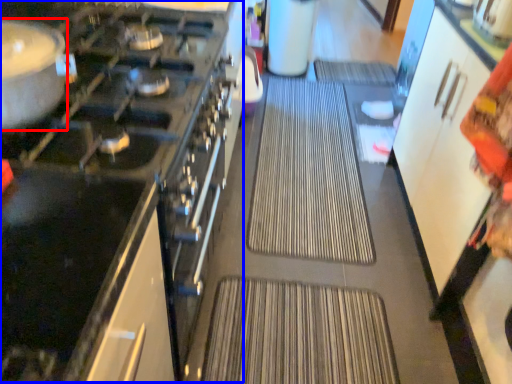
Question: Which object is further to the camera taking this photo, kitchen appliance (highlighted by a red box) or appliance (highlighted by a blue box)?

Choices:
 (A) kitchen appliance
 (B) appliance

Answer: (B)